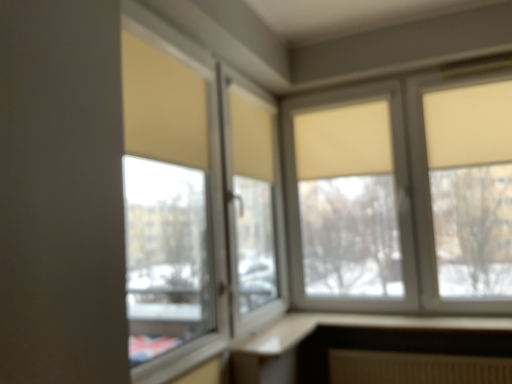
Consider the image. Measure the distance between matte beige roller blinds at upper right, which is the 1th window from right to left, and camera.

2.39 meters.

Describe the element at coordinates (195, 201) in the screenshot. This screenshot has height=384, width=512. I see `matte glass window at center, which is counted as the 1th window, starting from the left` at that location.

What do you see at coordinates (343, 141) in the screenshot? I see `beige fabric curtain at center` at bounding box center [343, 141].

Locate an element on the screen. matte beige roller blinds at upper right, which is counted as the 2th window, starting from the front is located at coordinates (403, 193).

Consider the image. Would you say beige fabric curtain at center is inside or outside matte glass window at center, which is counted as the 1th window, starting from the left?

The correct answer is: outside.

Is beige fabric curtain at center facing away from matte glass window at center, the 2th window from the right?

beige fabric curtain at center does not have its back to matte glass window at center, the 2th window from the right.

How many degrees apart are the facing directions of beige fabric curtain at center and matte glass window at center, which is the second window from back to front?

89.5 degrees.

Considering their positions, is matte beige roller blinds at upper right, which is counted as the second window, starting from the left, located in front of or behind matte glass window at center, which is the second window from back to front?

matte beige roller blinds at upper right, which is counted as the second window, starting from the left, is behind matte glass window at center, which is the second window from back to front.

From a real-world perspective, which object stands above the other?

matte beige roller blinds at upper right, which is the 1th window from right to left, is physically above.

Between matte beige roller blinds at upper right, placed as the first window when sorted from back to front, and matte glass window at center, the 2th window from the right, which one has less height?

Standing shorter between the two is matte beige roller blinds at upper right, placed as the first window when sorted from back to front.

Who is smaller, matte glass window at center, the 1th window from the front, or matte beige roller blinds at upper right, which is the 1th window from right to left?

With smaller size is matte glass window at center, the 1th window from the front.

Would you say matte glass window at center, which is the second window from back to front, contains matte beige roller blinds at upper right, which is counted as the second window, starting from the left?

Actually, matte beige roller blinds at upper right, which is counted as the second window, starting from the left, is outside matte glass window at center, which is the second window from back to front.

Is there a large distance between matte glass window at center, which is counted as the 1th window, starting from the left, and matte beige roller blinds at upper right, placed as the first window when sorted from back to front?

matte glass window at center, which is counted as the 1th window, starting from the left, is near matte beige roller blinds at upper right, placed as the first window when sorted from back to front, not far away.

Considering the relative sizes of matte glass window at center, which is the second window from back to front, and matte beige roller blinds at upper right, placed as the first window when sorted from back to front, in the image provided, is matte glass window at center, which is the second window from back to front, thinner than matte beige roller blinds at upper right, placed as the first window when sorted from back to front,?

No.

Considering the positions of point (314, 138) and point (501, 132), is point (314, 138) closer or farther from the camera than point (501, 132)?

Point (314, 138) appears to be farther away from the viewer than point (501, 132).

Based on the photo, from the image's perspective, is beige fabric curtain at center over matte beige roller blinds at upper right, which is counted as the second window, starting from the left?

Yes, from the image's perspective, beige fabric curtain at center is on top of matte beige roller blinds at upper right, which is counted as the second window, starting from the left.

Is matte beige roller blinds at upper right, which is counted as the 2th window, starting from the front, surrounded by beige fabric curtain at center?

Actually, matte beige roller blinds at upper right, which is counted as the 2th window, starting from the front, is outside beige fabric curtain at center.

Which of these two, beige fabric curtain at center or matte beige roller blinds at upper right, placed as the first window when sorted from back to front, is smaller?

beige fabric curtain at center.

Can you tell me how much matte glass window at center, the 1th window from the front, and beige fabric curtain at center differ in facing direction?

The angle between the facing direction of matte glass window at center, the 1th window from the front, and the facing direction of beige fabric curtain at center is 89.5 degrees.

Considering the sizes of objects matte glass window at center, which is the second window from back to front, and beige fabric curtain at center in the image provided, who is thinner, matte glass window at center, which is the second window from back to front, or beige fabric curtain at center?

beige fabric curtain at center.

Looking at this image, from the image's perspective, would you say matte glass window at center, the 1th window from the front, is shown under beige fabric curtain at center?

Yes, from the image's perspective, matte glass window at center, the 1th window from the front, is beneath beige fabric curtain at center.

In the image, is matte glass window at center, which is counted as the 1th window, starting from the left, on the left side or the right side of beige fabric curtain at center?

Based on their positions, matte glass window at center, which is counted as the 1th window, starting from the left, is located to the left of beige fabric curtain at center.

Can you confirm if matte beige roller blinds at upper right, which is counted as the second window, starting from the left, is thinner than beige fabric curtain at center?

No, matte beige roller blinds at upper right, which is counted as the second window, starting from the left, is not thinner than beige fabric curtain at center.

Are matte beige roller blinds at upper right, which is the 1th window from right to left, and beige fabric curtain at center far apart?

No, matte beige roller blinds at upper right, which is the 1th window from right to left, is in close proximity to beige fabric curtain at center.

Can you confirm if matte beige roller blinds at upper right, which is the 1th window from right to left, is smaller than beige fabric curtain at center?

Incorrect, matte beige roller blinds at upper right, which is the 1th window from right to left, is not smaller in size than beige fabric curtain at center.

Is matte beige roller blinds at upper right, which is the 1th window from right to left, not within beige fabric curtain at center?

Yes.

Locate an element on the screen. This screenshot has height=384, width=512. curtain on the right of matte glass window at center, the 1th window from the front is located at coordinates (343, 141).

Locate an element on the screen. This screenshot has height=384, width=512. window in front of the matte beige roller blinds at upper right, which is counted as the second window, starting from the left is located at coordinates (195, 201).

Estimate the real-world distances between objects in this image. Which object is closer to matte beige roller blinds at upper right, which is counted as the 2th window, starting from the front, beige fabric curtain at center or matte glass window at center, the 1th window from the front?

Based on the image, beige fabric curtain at center appears to be nearer to matte beige roller blinds at upper right, which is counted as the 2th window, starting from the front.

When comparing their distances from matte glass window at center, the 2th window from the right, does beige fabric curtain at center or matte beige roller blinds at upper right, which is counted as the 2th window, starting from the front, seem closer?

beige fabric curtain at center.

Consider the image. When comparing their distances from matte glass window at center, which is the second window from back to front, does matte beige roller blinds at upper right, which is counted as the second window, starting from the left, or beige fabric curtain at center seem further?

The object further to matte glass window at center, which is the second window from back to front, is matte beige roller blinds at upper right, which is counted as the second window, starting from the left.

Looking at the image, which one is located closer to matte beige roller blinds at upper right, which is the 1th window from right to left, matte glass window at center, the 2th window from the right, or beige fabric curtain at center?

beige fabric curtain at center is positioned closer to the anchor matte beige roller blinds at upper right, which is the 1th window from right to left.

Based on their spatial positions, is matte glass window at center, which is the second window from back to front, or matte beige roller blinds at upper right, which is counted as the 2th window, starting from the front, further from beige fabric curtain at center?

matte glass window at center, which is the second window from back to front, is further to beige fabric curtain at center.

When comparing their distances from beige fabric curtain at center, does matte beige roller blinds at upper right, which is counted as the 2th window, starting from the front, or matte glass window at center, which is counted as the 1th window, starting from the left, seem further?

Among the two, matte glass window at center, which is counted as the 1th window, starting from the left, is located further to beige fabric curtain at center.

Where is `window between matte glass window at center, which is counted as the 1th window, starting from the left, and beige fabric curtain at center in the front-back direction`? The width and height of the screenshot is (512, 384). window between matte glass window at center, which is counted as the 1th window, starting from the left, and beige fabric curtain at center in the front-back direction is located at coordinates (403, 193).